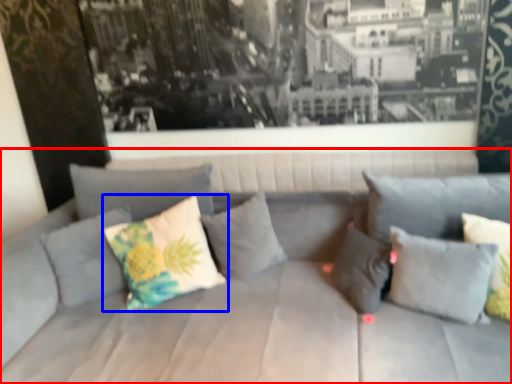
Question: Among these objects, which one is farthest to the camera, studio couch (highlighted by a red box) or pillow (highlighted by a blue box)?

Choices:
 (A) studio couch
 (B) pillow

Answer: (B)